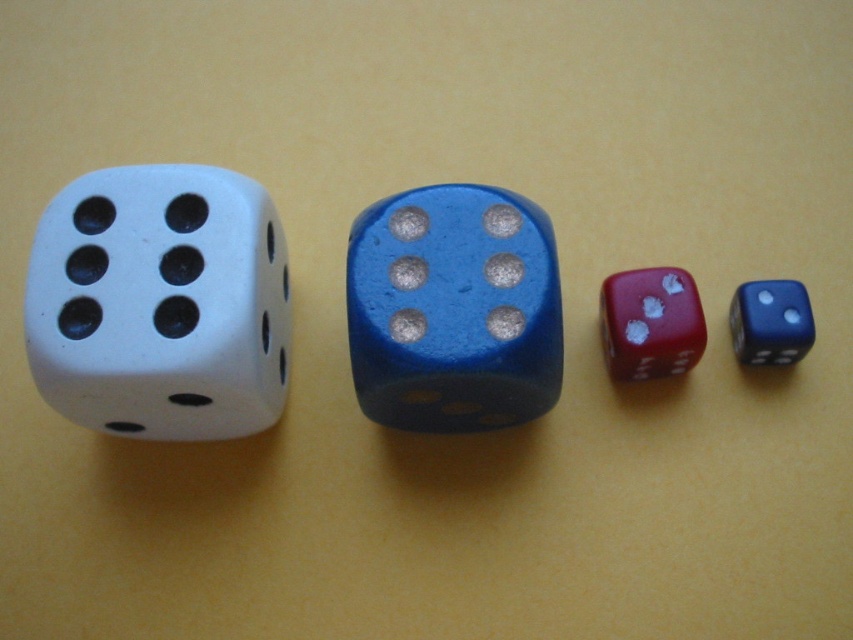
Question: Which object is positioned closest to the matte white die at left?

Choices:
 (A) matte white dice at left
 (B) rubberized red dice at center right

Answer: (A)

Question: Which point is closer to the camera taking this photo?

Choices:
 (A) (755, 333)
 (B) (660, 268)

Answer: (A)

Question: Does matte white dice at left appear over matte white die at left?

Choices:
 (A) no
 (B) yes

Answer: (A)

Question: Estimate the real-world distances between objects in this image. Which object is closer to the matte white die at left?

Choices:
 (A) blue glossy die at center
 (B) matte white dice at left
 (C) shiny blue die at right

Answer: (B)

Question: Can you confirm if matte white dice at left is bigger than matte white die at left?

Choices:
 (A) no
 (B) yes

Answer: (B)

Question: Considering the relative positions of matte white dice at left and matte white die at left in the image provided, where is matte white dice at left located with respect to matte white die at left?

Choices:
 (A) above
 (B) below

Answer: (B)